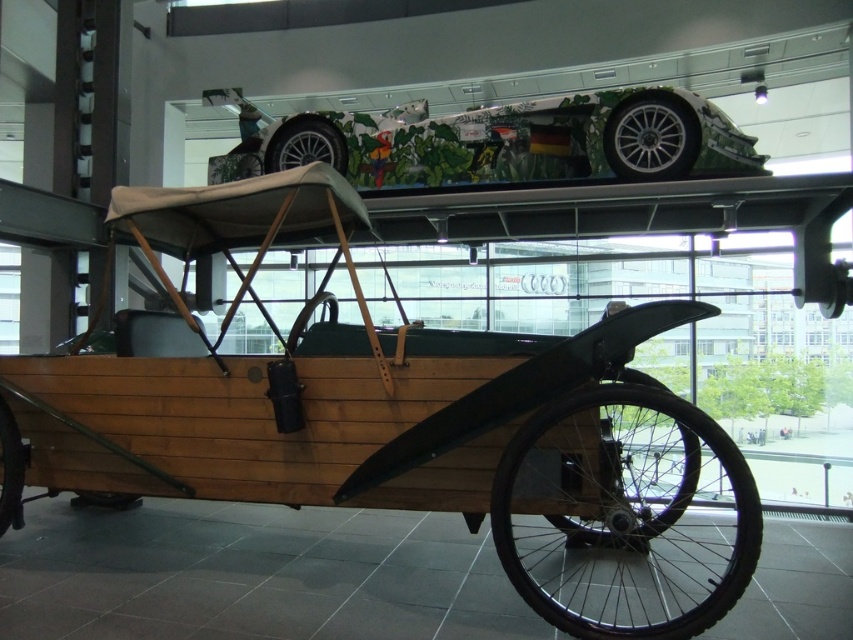
Question: Among these objects, which one is farthest from the camera?

Choices:
 (A) green leafy paintwork at upper center
 (B) wooden tricycle at lower left

Answer: (A)

Question: Which object appears closest to the camera in this image?

Choices:
 (A) green leafy paintwork at upper center
 (B) wooden tricycle at lower left

Answer: (B)

Question: Among these objects, which one is farthest from the camera?

Choices:
 (A) wooden tricycle at lower left
 (B) green leafy paintwork at upper center

Answer: (B)

Question: Does wooden tricycle at lower left appear on the right side of green leafy paintwork at upper center?

Choices:
 (A) yes
 (B) no

Answer: (A)

Question: Is wooden tricycle at lower left below green leafy paintwork at upper center?

Choices:
 (A) no
 (B) yes

Answer: (B)

Question: Can you confirm if wooden tricycle at lower left is wider than green leafy paintwork at upper center?

Choices:
 (A) no
 (B) yes

Answer: (A)